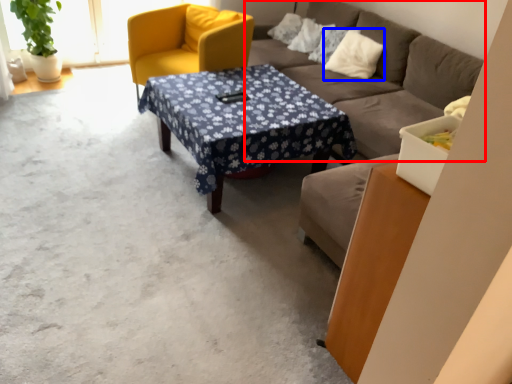
Question: Which point is further to the camera, studio couch (highlighted by a red box) or pillow (highlighted by a blue box)?

Choices:
 (A) studio couch
 (B) pillow

Answer: (B)